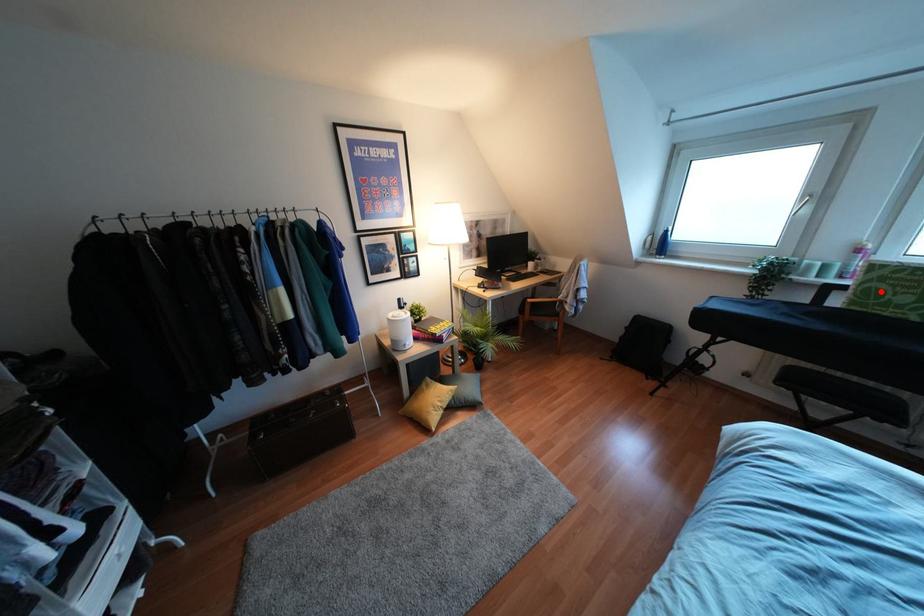
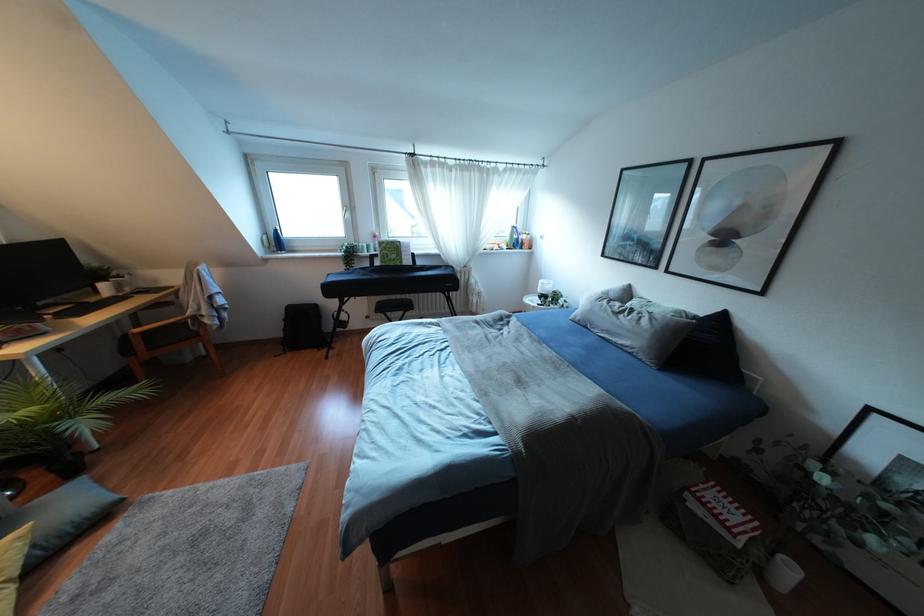
Question: A red point is marked in image1. In image2, is the corresponding 3D point closer to the camera or farther? Reply with the corresponding letter.

Choices:
 (A) The corresponding 3D point is closer.
 (B) The corresponding 3D point is farther.

Answer: (A)